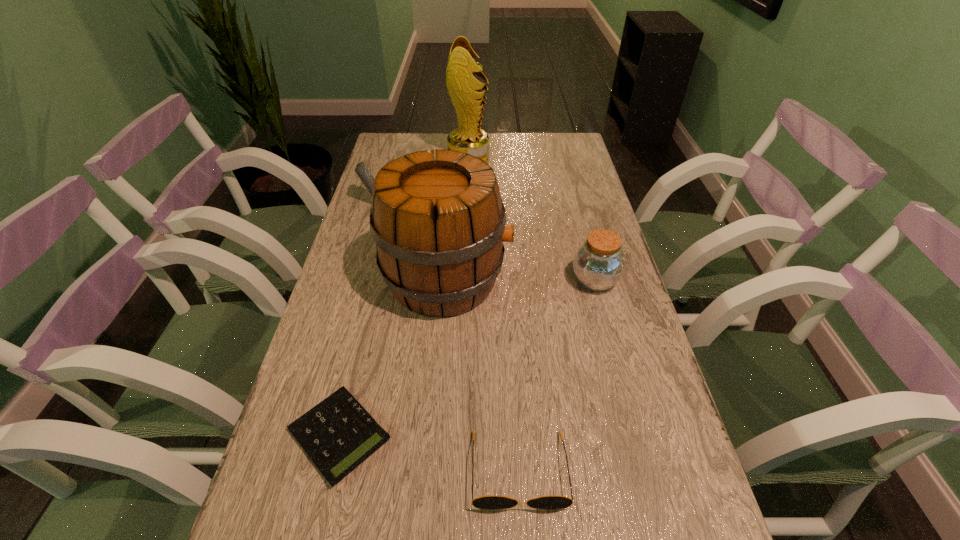
Where is `the farthest object`? the farthest object is located at coordinates (463, 88).

Where is `award`? Image resolution: width=960 pixels, height=540 pixels. award is located at coordinates coord(463,88).

Identify the location of the fifth shortest object. (439, 223).

The image size is (960, 540). In order to click on jar in this screenshot , I will do coord(598,264).

In order to click on the second farthest object in this screenshot , I will do (x=361, y=170).

Find the location of `the taller calculator`. the taller calculator is located at coordinates (361, 170).

Where is `sunglasses`? sunglasses is located at coordinates (484, 502).

Locate an element on the screen. This screenshot has width=960, height=540. the nearer calculator is located at coordinates (337, 434).

The height and width of the screenshot is (540, 960). I want to click on the shorter calculator, so click(x=337, y=434).

Locate an element on the screen. free region located on the front-facing side of the farthest object is located at coordinates (557, 159).